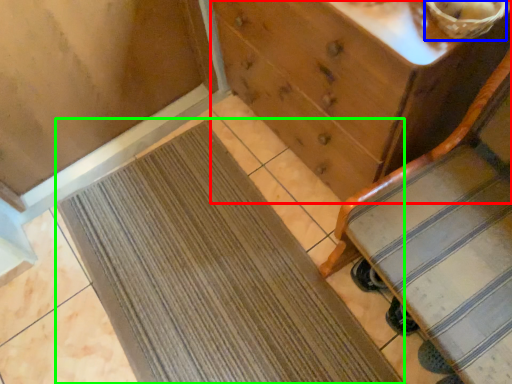
Question: Which object is the closest to the chest of drawers (highlighted by a red box)? Choose among these: basket (highlighted by a blue box) or doormat (highlighted by a green box).

Choices:
 (A) basket
 (B) doormat

Answer: (A)